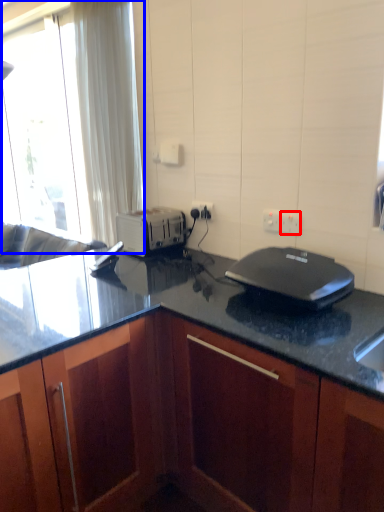
Question: Which object is further to the camera taking this photo, electric outlet (highlighted by a red box) or window (highlighted by a blue box)?

Choices:
 (A) electric outlet
 (B) window

Answer: (B)